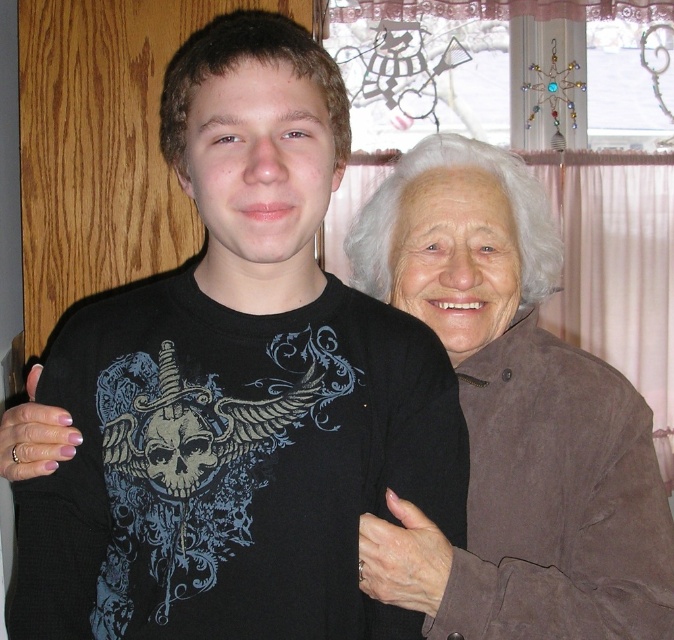
Does black matte t-shirt at center have a larger size compared to smooth brown hand at lower right?

Correct, black matte t-shirt at center is larger in size than smooth brown hand at lower right.

Measure the distance between black matte t-shirt at center and camera.

A distance of 28.04 inches exists between black matte t-shirt at center and camera.

Who is more distant from viewer, (x=228, y=632) or (x=419, y=525)?

The point (x=419, y=525) is more distant.

Find the location of a particular element. black matte t-shirt at center is located at coordinates (237, 390).

Who is more forward, (313, 563) or (384, 288)?

Point (313, 563)

Can you confirm if black matte t-shirt at center is positioned below white suede jacket at upper right?

No, black matte t-shirt at center is not below white suede jacket at upper right.

Find the location of `black matte t-shirt at center`. black matte t-shirt at center is located at coordinates (237, 390).

From the picture: Does white suede jacket at upper right appear on the right side of smooth brown hand at lower right?

Correct, you'll find white suede jacket at upper right to the right of smooth brown hand at lower right.

Is the position of white suede jacket at upper right less distant than that of smooth brown hand at lower right?

Yes, white suede jacket at upper right is in front of smooth brown hand at lower right.

I want to click on white suede jacket at upper right, so click(512, 419).